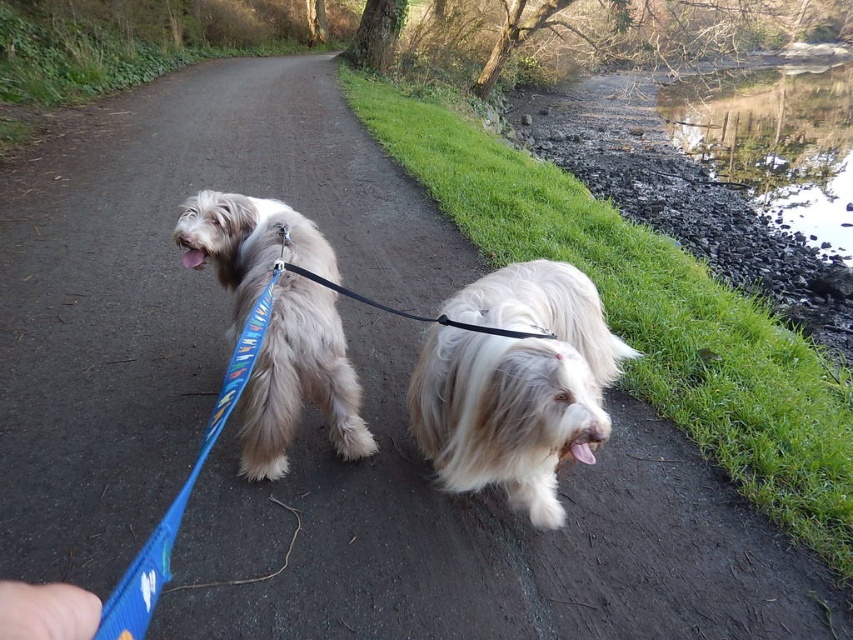
Can you confirm if white fluffy dog at center is positioned to the left of black nylon leash at center?

In fact, white fluffy dog at center is to the right of black nylon leash at center.

Which is above, white fluffy dog at center or black nylon leash at center?

Positioned higher is black nylon leash at center.

Between point (566, 307) and point (328, 280), which one is positioned behind?

Positioned behind is point (566, 307).

At what (x,y) coordinates should I click in order to perform the action: click on white fluffy dog at center. Please return your answer as a coordinate pair (x, y). The height and width of the screenshot is (640, 853). Looking at the image, I should click on (515, 385).

Which is in front, point (577, 429) or point (262, 204)?

Point (577, 429) is in front.

Is point (520, 321) more distant than point (242, 456)?

No, (520, 321) is in front of (242, 456).

At what (x,y) coordinates should I click in order to perform the action: click on white fluffy dog at center. Please return your answer as a coordinate pair (x, y). The width and height of the screenshot is (853, 640). Looking at the image, I should click on (515, 385).

What do you see at coordinates (515, 385) in the screenshot? The width and height of the screenshot is (853, 640). I see `white fluffy dog at center` at bounding box center [515, 385].

Which is more to the right, white fluffy dog at center or smooth gravel creek at upper right?

From the viewer's perspective, smooth gravel creek at upper right appears more on the right side.

Image resolution: width=853 pixels, height=640 pixels. I want to click on white fluffy dog at center, so click(515, 385).